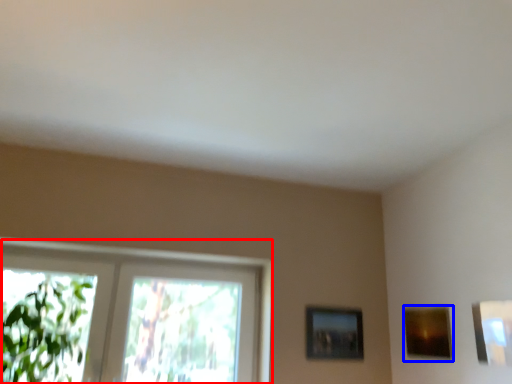
Question: Among these objects, which one is farthest to the camera, window (highlighted by a red box) or picture frame (highlighted by a blue box)?

Choices:
 (A) window
 (B) picture frame

Answer: (A)